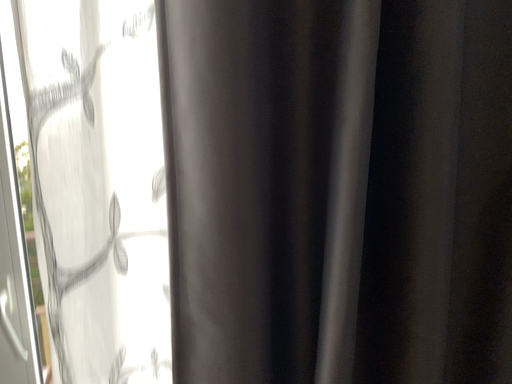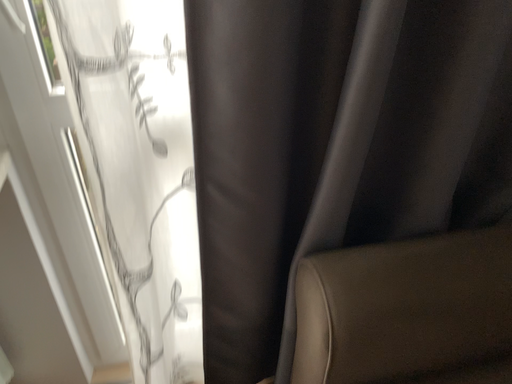
Question: Which way did the camera rotate in the video?

Choices:
 (A) rotated upward
 (B) rotated downward

Answer: (B)